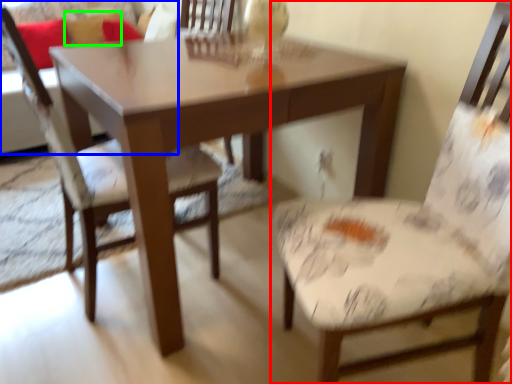
Question: Based on their relative distances, which object is farther from chair (highlighted by a red box)? Choose from couch (highlighted by a blue box) and pillow (highlighted by a green box).

Choices:
 (A) couch
 (B) pillow

Answer: (B)